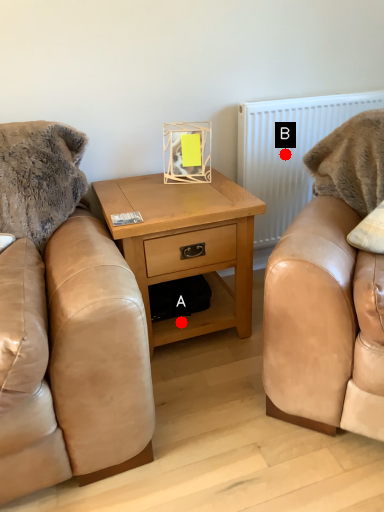
Question: Two points are circled on the image, labeled by A and B beside each circle. Which point is farther to the camera?

Choices:
 (A) A is further
 (B) B is further

Answer: (B)